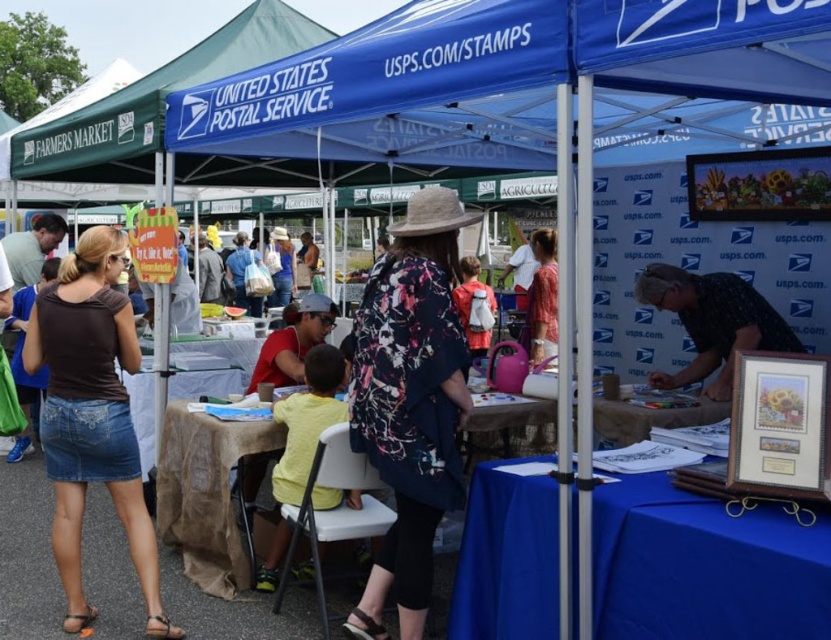
Question: Does brown denim skirt at lower left have a larger size compared to floral fabric dress at center?

Choices:
 (A) no
 (B) yes

Answer: (B)

Question: Is blue fabric table at lower right thinner than brown denim skirt at lower left?

Choices:
 (A) no
 (B) yes

Answer: (A)

Question: Is brown burlap table at center to the left of floral fabric dress at center from the viewer's perspective?

Choices:
 (A) no
 (B) yes

Answer: (B)

Question: Which object is positioned farthest from the brown burlap table at center?

Choices:
 (A) floral-patterned shirt at center
 (B) blue fabric table at lower right

Answer: (B)

Question: Which point is closer to the camera?

Choices:
 (A) blue fabric table at lower right
 (B) brown burlap table at center

Answer: (A)

Question: Which of the following is the closest to the observer?

Choices:
 (A) (x=485, y=416)
 (B) (x=428, y=588)
 (C) (x=529, y=348)

Answer: (B)